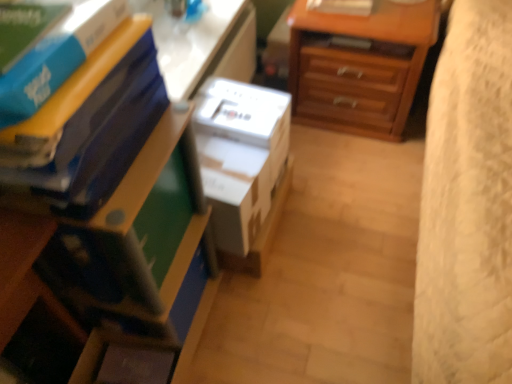
Identify the location of free point above white plastic table at upper center (from a real-world perspective). This screenshot has height=384, width=512. (181, 41).